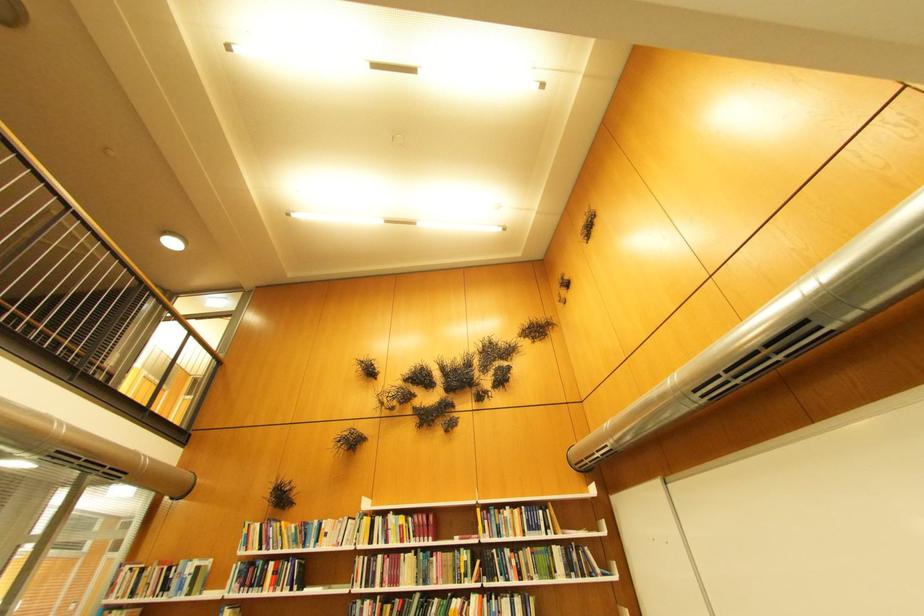
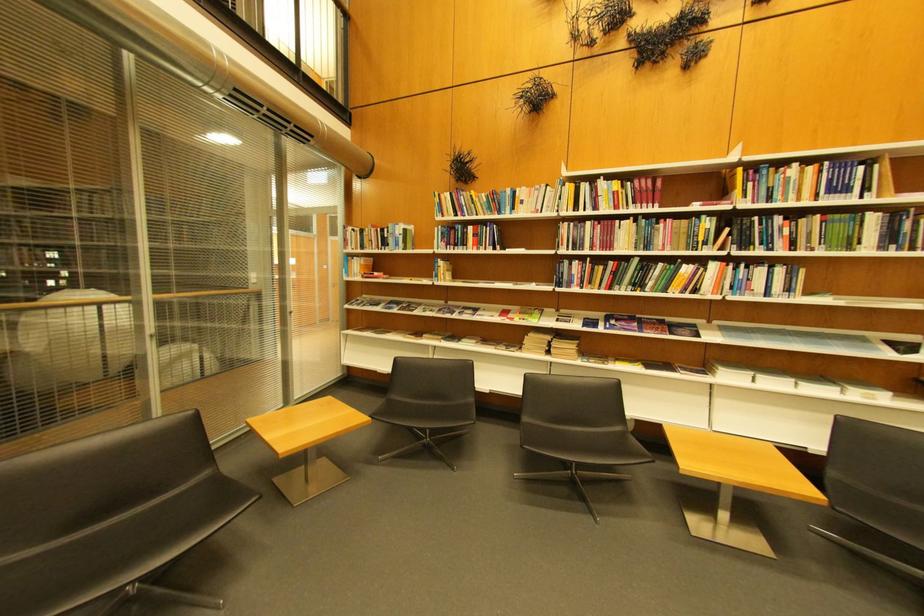
The point at (391,559) is marked in the first image. Where is the corresponding point in the second image?

(600, 225)